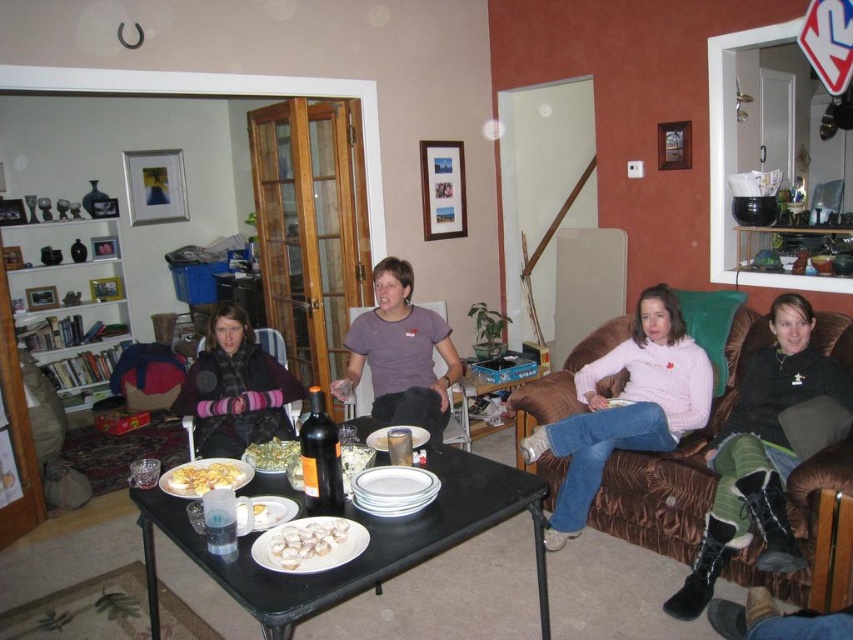
Question: Can you confirm if matte black armchair at lower left is positioned to the left of yellow matte plate at center?

Choices:
 (A) yes
 (B) no

Answer: (A)

Question: Which point is farther to the camera?

Choices:
 (A) (463, 458)
 (B) (238, 435)
 (C) (660, 440)
 (D) (260, 563)

Answer: (B)

Question: Among these objects, which one is nearest to the camera?

Choices:
 (A) brown fabric couch at right
 (B) matte black armchair at lower left
 (C) green leafy salad at center
 (D) white glossy cookies at center

Answer: (D)

Question: Can you confirm if purple cotton shirt at center is bigger than matte black armchair at lower left?

Choices:
 (A) yes
 (B) no

Answer: (A)

Question: Can you confirm if pink fleece sweater at center is positioned below yellow matte plate at center?

Choices:
 (A) no
 (B) yes

Answer: (A)

Question: Estimate the real-world distances between objects in this image. Which object is farther from the pink fleece sweater at center?

Choices:
 (A) brown fabric couch at right
 (B) yellow matte plate at center
 (C) white glossy cookies at center

Answer: (C)